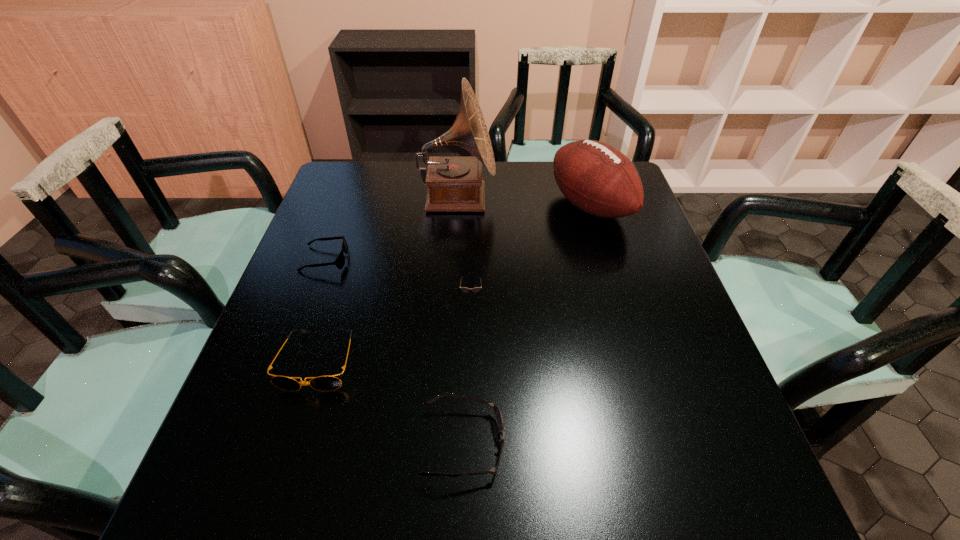
Where is `the tallest object`? The height and width of the screenshot is (540, 960). the tallest object is located at coordinates [454, 183].

Find the location of a particular element. This screenshot has height=540, width=960. the fifth shortest object is located at coordinates (595, 177).

This screenshot has height=540, width=960. I want to click on football (American), so click(595, 177).

Where is `the second farthest sunglasses`? This screenshot has height=540, width=960. the second farthest sunglasses is located at coordinates (464, 289).

Where is `the second nearest sunglasses`? This screenshot has height=540, width=960. the second nearest sunglasses is located at coordinates (322, 383).

The image size is (960, 540). What are the coordinates of `the nearest object` in the screenshot? It's located at (498, 415).

The height and width of the screenshot is (540, 960). I want to click on the shortest object, so click(x=340, y=260).

Locate an element on the screen. the farthest sunglasses is located at coordinates pyautogui.click(x=340, y=260).

At what (x,y) coordinates should I click in order to perform the action: click on vacant space located 0.370m on the horn of the tallest object. Please return your answer as a coordinate pair (x, y). The height and width of the screenshot is (540, 960). Looking at the image, I should click on (619, 199).

Locate an element on the screen. This screenshot has height=540, width=960. vacant region located 0.140m on the front of the football (American) is located at coordinates tap(611, 275).